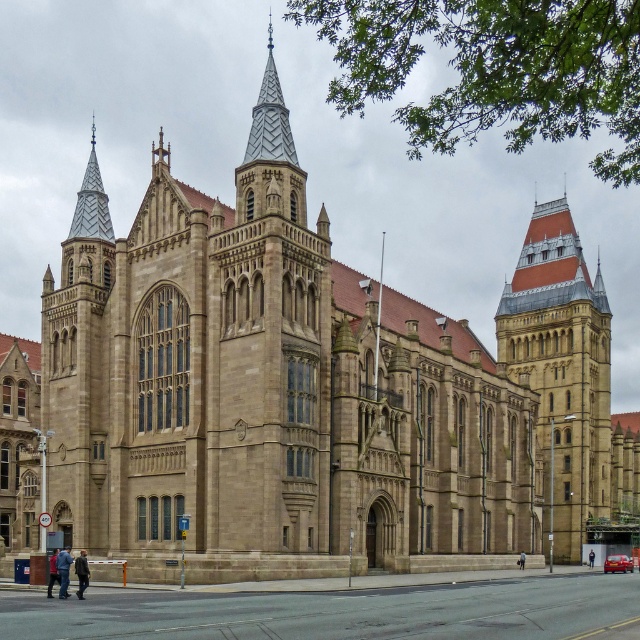
Consider the image. Does brown stone tower at upper right appear on the left side of silver mosaic spire at upper left?

In fact, brown stone tower at upper right is to the right of silver mosaic spire at upper left.

Does brown stone tower at upper right appear on the right side of silver mosaic spire at upper left?

Indeed, brown stone tower at upper right is positioned on the right side of silver mosaic spire at upper left.

Who is more forward, (x=570, y=472) or (x=83, y=236)?

Point (x=83, y=236) is in front.

At what (x,y) coordinates should I click in order to perform the action: click on brown stone tower at upper right. Please return your answer as a coordinate pair (x, y). Looking at the image, I should click on (561, 371).